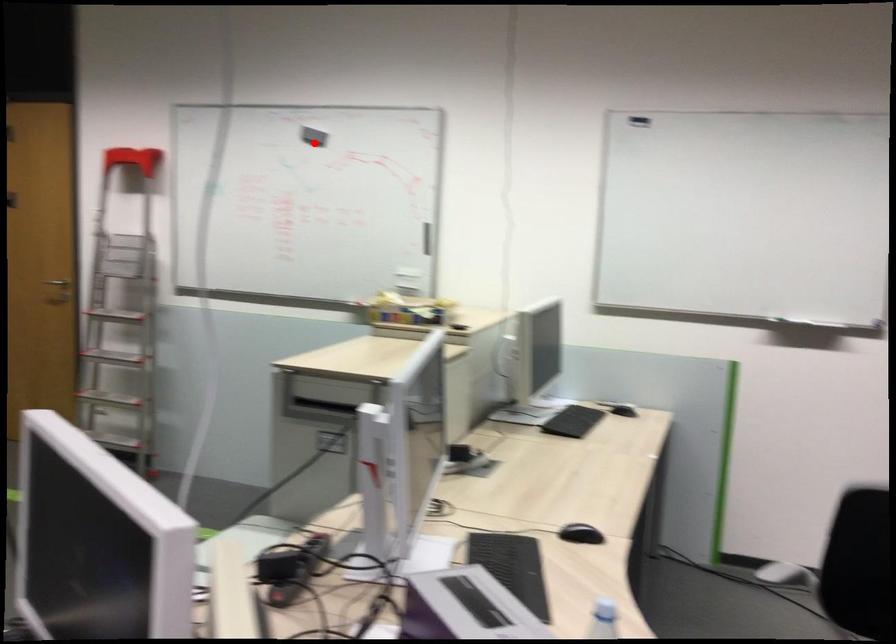
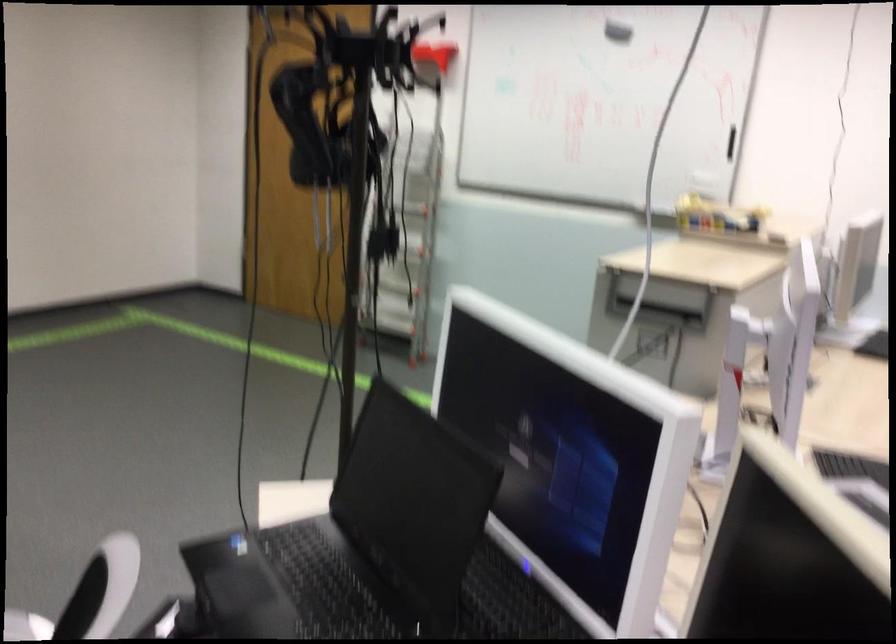
Find the pixel in the second image that matches the highlighted location in the first image.

(617, 32)